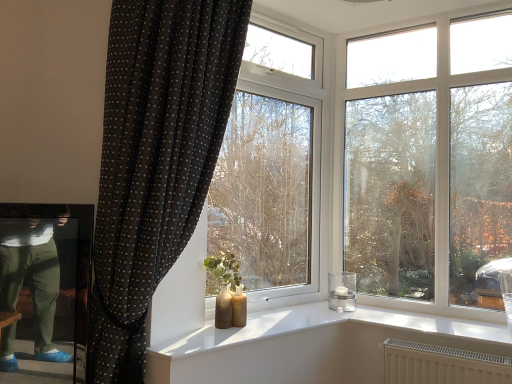
Question: Considering the relative sizes of transparent glass tree at center and black dotted fabric curtain at left in the image provided, is transparent glass tree at center shorter than black dotted fabric curtain at left?

Choices:
 (A) no
 (B) yes

Answer: (B)

Question: Can you confirm if transparent glass tree at center is wider than black dotted fabric curtain at left?

Choices:
 (A) yes
 (B) no

Answer: (B)

Question: Does transparent glass tree at center lie in front of black dotted fabric curtain at left?

Choices:
 (A) no
 (B) yes

Answer: (A)

Question: Is transparent glass tree at center aimed at black dotted fabric curtain at left?

Choices:
 (A) yes
 (B) no

Answer: (A)

Question: From a real-world perspective, is transparent glass tree at center beneath black dotted fabric curtain at left?

Choices:
 (A) no
 (B) yes

Answer: (A)

Question: Is point (388, 246) closer or farther from the camera than point (339, 274)?

Choices:
 (A) closer
 (B) farther

Answer: (A)

Question: In the image, is transparent glass tree at center positioned in front of or behind clear glass candle holder at window?

Choices:
 (A) behind
 (B) front

Answer: (B)

Question: From the image's perspective, is transparent glass tree at center located above or below clear glass candle holder at window?

Choices:
 (A) below
 (B) above

Answer: (B)

Question: Do you think transparent glass tree at center is within clear glass candle holder at window, or outside of it?

Choices:
 (A) inside
 (B) outside

Answer: (B)

Question: Considering the positions of transparent glass tree at center and transparent glass window at center in the image, is transparent glass tree at center taller or shorter than transparent glass window at center?

Choices:
 (A) short
 (B) tall

Answer: (A)

Question: In terms of width, does transparent glass tree at center look wider or thinner when compared to transparent glass window at center?

Choices:
 (A) thin
 (B) wide

Answer: (A)

Question: Choose the correct answer: Is transparent glass tree at center inside transparent glass window at center or outside it?

Choices:
 (A) inside
 (B) outside

Answer: (B)

Question: Considering the positions of transparent glass tree at center and transparent glass window at center in the image, is transparent glass tree at center bigger or smaller than transparent glass window at center?

Choices:
 (A) small
 (B) big

Answer: (A)

Question: Is transparent glass window at center to the left or to the right of black dotted fabric curtain at left in the image?

Choices:
 (A) left
 (B) right

Answer: (B)

Question: In terms of width, does transparent glass window at center look wider or thinner when compared to black dotted fabric curtain at left?

Choices:
 (A) wide
 (B) thin

Answer: (B)